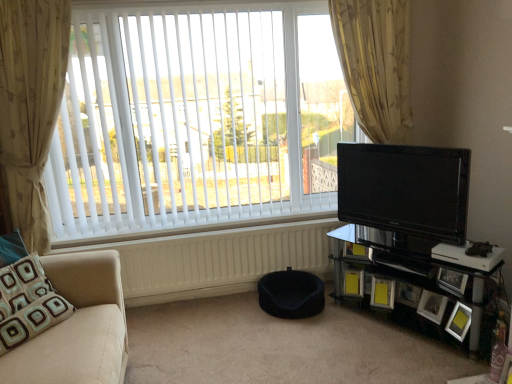
At what (x,y) coordinates should I click in order to perform the action: click on vacant space in front of black fabric bean bag at center. Please return your answer as a coordinate pair (x, y). The image size is (512, 384). Looking at the image, I should click on (302, 336).